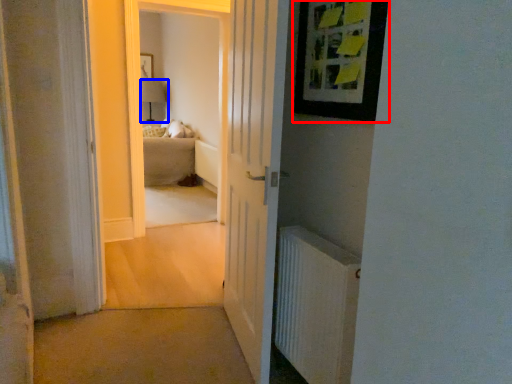
Question: Which object appears farthest to the camera in this image, picture frame (highlighted by a red box) or lamp (highlighted by a blue box)?

Choices:
 (A) picture frame
 (B) lamp

Answer: (B)